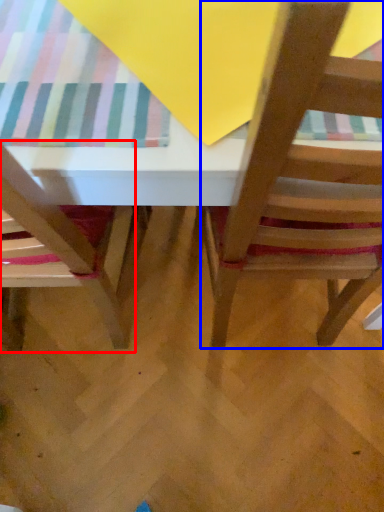
Question: Which object appears closest to the camera in this image, chair (highlighted by a red box) or chair (highlighted by a blue box)?

Choices:
 (A) chair
 (B) chair

Answer: (B)